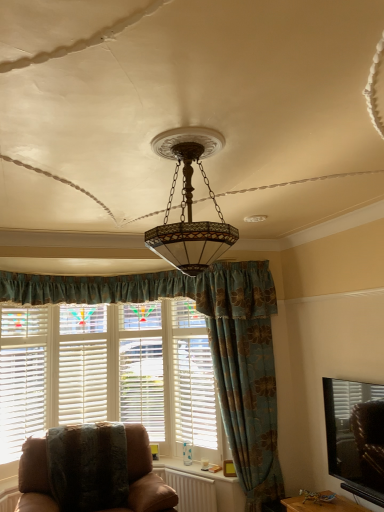
Question: Considering the relative positions of blue floral fabric curtain at center and white plastic radiator at lower center in the image provided, is blue floral fabric curtain at center behind white plastic radiator at lower center?

Choices:
 (A) yes
 (B) no

Answer: (B)

Question: Considering the relative sizes of blue floral fabric curtain at center and white plastic radiator at lower center in the image provided, is blue floral fabric curtain at center wider than white plastic radiator at lower center?

Choices:
 (A) no
 (B) yes

Answer: (B)

Question: From the image's perspective, is blue floral fabric curtain at center located above white plastic radiator at lower center?

Choices:
 (A) yes
 (B) no

Answer: (A)

Question: Can you confirm if blue floral fabric curtain at center is thinner than white plastic radiator at lower center?

Choices:
 (A) yes
 (B) no

Answer: (B)

Question: Is blue floral fabric curtain at center looking in the opposite direction of white plastic radiator at lower center?

Choices:
 (A) no
 (B) yes

Answer: (A)

Question: Is white wooden blinds at left taller or shorter than white wood shutter at center?

Choices:
 (A) tall
 (B) short

Answer: (A)

Question: From the image's perspective, is white wooden blinds at left located above or below white wood shutter at center?

Choices:
 (A) above
 (B) below

Answer: (A)

Question: Would you say white wooden blinds at left is to the left or to the right of white wood shutter at center in the picture?

Choices:
 (A) left
 (B) right

Answer: (A)

Question: Considering the positions of white wooden blinds at left and white wood shutter at center in the image, is white wooden blinds at left bigger or smaller than white wood shutter at center?

Choices:
 (A) small
 (B) big

Answer: (A)

Question: Is point (246, 472) closer or farther from the camera than point (147, 501)?

Choices:
 (A) closer
 (B) farther

Answer: (B)

Question: In terms of width, does blue floral fabric curtain at center look wider or thinner when compared to brown leather chair at lower left?

Choices:
 (A) wide
 (B) thin

Answer: (B)

Question: Relative to brown leather chair at lower left, is blue floral fabric curtain at center in front or behind?

Choices:
 (A) front
 (B) behind

Answer: (B)

Question: From the image's perspective, is blue floral fabric curtain at center positioned above or below brown leather chair at lower left?

Choices:
 (A) below
 (B) above

Answer: (B)

Question: Is white wood window frame at center spatially inside white plastic radiator at lower center, or outside of it?

Choices:
 (A) inside
 (B) outside

Answer: (B)

Question: From the image's perspective, relative to white plastic radiator at lower center, is white wood window frame at center above or below?

Choices:
 (A) below
 (B) above

Answer: (B)